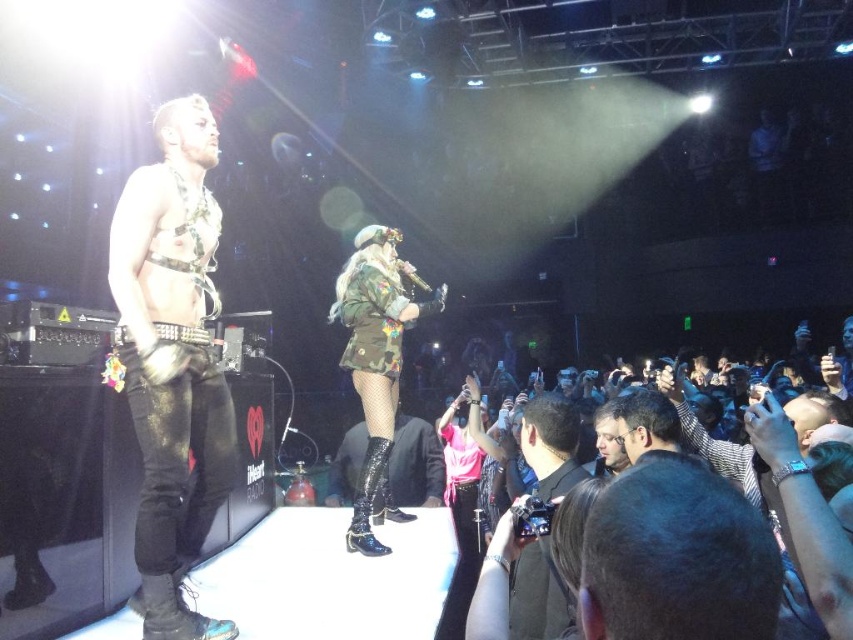
Is point (630, 616) in front of point (454, 435)?

Yes, point (630, 616) is in front of point (454, 435).

Which is above, dark brown hair at lower right or pink satin dress at center?

dark brown hair at lower right

The image size is (853, 640). Find the location of `dark brown hair at lower right`. dark brown hair at lower right is located at coordinates (677, 557).

What do you see at coordinates (677, 557) in the screenshot? I see `dark brown hair at lower right` at bounding box center [677, 557].

How distant is dark brown hair at lower right from glossy patent leather boot at center?

dark brown hair at lower right is 9.25 feet away from glossy patent leather boot at center.

Image resolution: width=853 pixels, height=640 pixels. Identify the location of dark brown hair at lower right. 677,557.

Who is more forward, (x=164, y=275) or (x=466, y=536)?

Point (x=164, y=275)

Consider the image. Does shiny black leather pants at left have a greater height compared to pink satin dress at center?

Yes.

Is point (115, 227) closer to camera compared to point (467, 547)?

That is True.

Where is `shiny black leather pants at left`? shiny black leather pants at left is located at coordinates (172, 362).